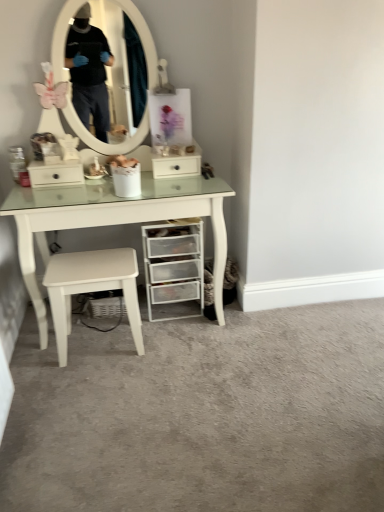
Question: Is point (198, 315) closer or farther from the camera than point (119, 276)?

Choices:
 (A) farther
 (B) closer

Answer: (A)

Question: Is clear plastic drawers at lower right to the left or to the right of white matte stool at lower center in the image?

Choices:
 (A) left
 (B) right

Answer: (B)

Question: Estimate the real-world distances between objects in this image. Which object is closer to the white matte stool at lower center?

Choices:
 (A) white glossy table at center
 (B) white glossy drawer at center
 (C) clear plastic drawers at lower right

Answer: (A)

Question: Which is farther from the white glossy drawer at center?

Choices:
 (A) white matte stool at lower center
 (B) white glossy table at center
 (C) clear plastic drawers at lower right

Answer: (A)